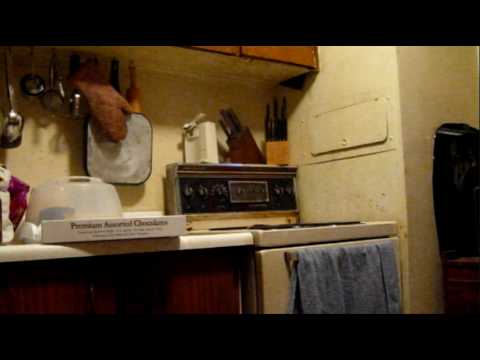
At what (x,y) coordinates should I click in order to perform the action: click on edge counter top. Please return your answer as a coordinate pair (x, y). The height and width of the screenshot is (360, 480). Looking at the image, I should click on pyautogui.click(x=30, y=255), pyautogui.click(x=126, y=246), pyautogui.click(x=200, y=240).